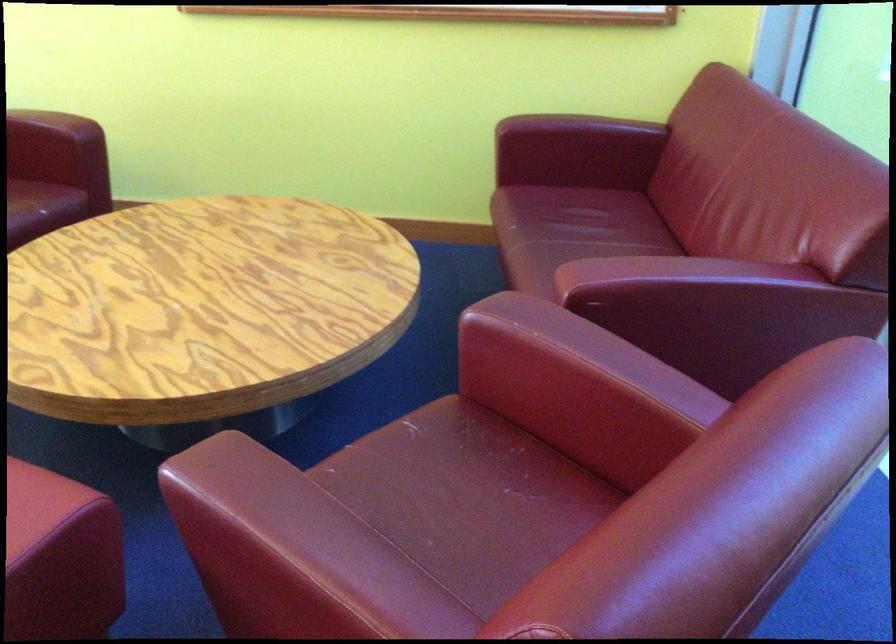
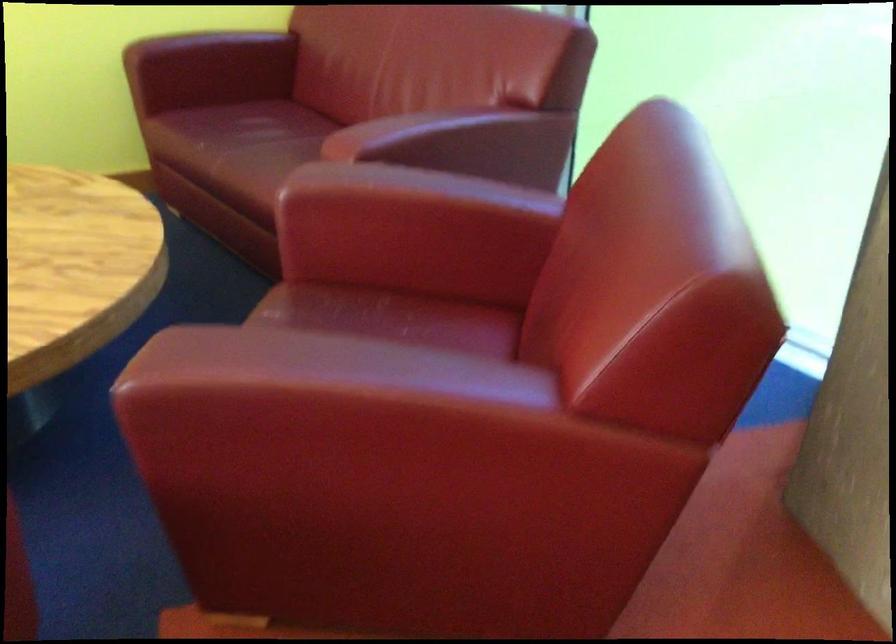
Where in the second image is the point corresponding to point (556, 154) from the first image?

(208, 69)